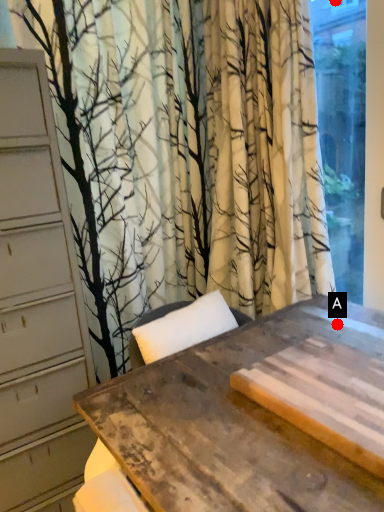
Question: Two points are circled on the image, labeled by A and B beside each circle. Among these points, which one is farthest from the camera?

Choices:
 (A) A is further
 (B) B is further

Answer: (B)